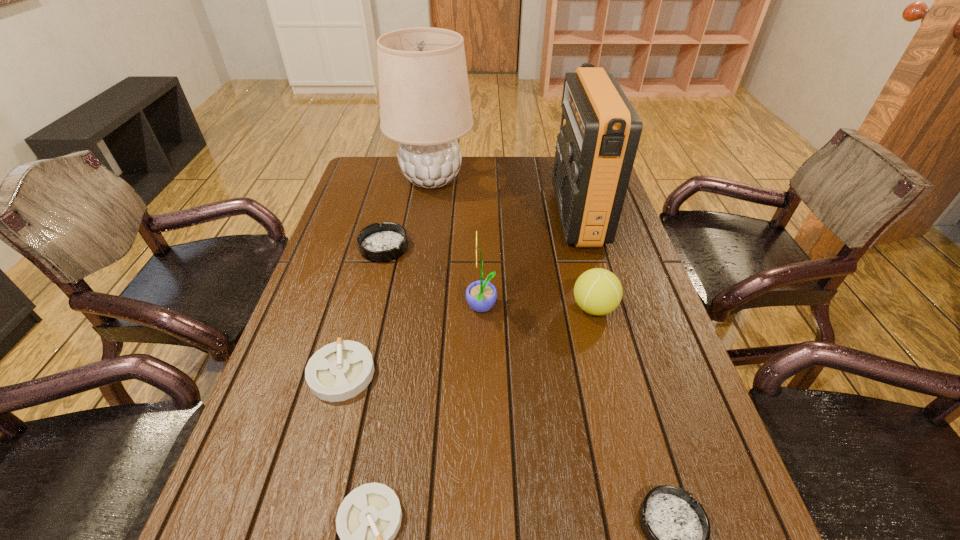
Image resolution: width=960 pixels, height=540 pixels. In order to click on radio receiver that is at the far edge in this screenshot , I will do (x=600, y=130).

The height and width of the screenshot is (540, 960). I want to click on lampshade positioned at the left edge, so click(425, 105).

This screenshot has width=960, height=540. In order to click on radio receiver located at the right edge in this screenshot , I will do `click(600, 130)`.

Where is `tennis ball at the right edge`? tennis ball at the right edge is located at coordinates (597, 291).

Locate an element on the screen. object located in the far left corner section of the desktop is located at coordinates (425, 105).

Where is `object situated at the far right corner`? The width and height of the screenshot is (960, 540). object situated at the far right corner is located at coordinates (600, 130).

Find the location of a particular element. The image size is (960, 540). vacant region at the far edge of the desktop is located at coordinates (544, 172).

In the image, there is a desktop. Identify the location of vacant area at the left edge. This screenshot has height=540, width=960. (345, 215).

Identify the location of free location at the right edge of the desktop. (628, 303).

Locate an element on the screen. free space at the far left corner of the desktop is located at coordinates (386, 183).